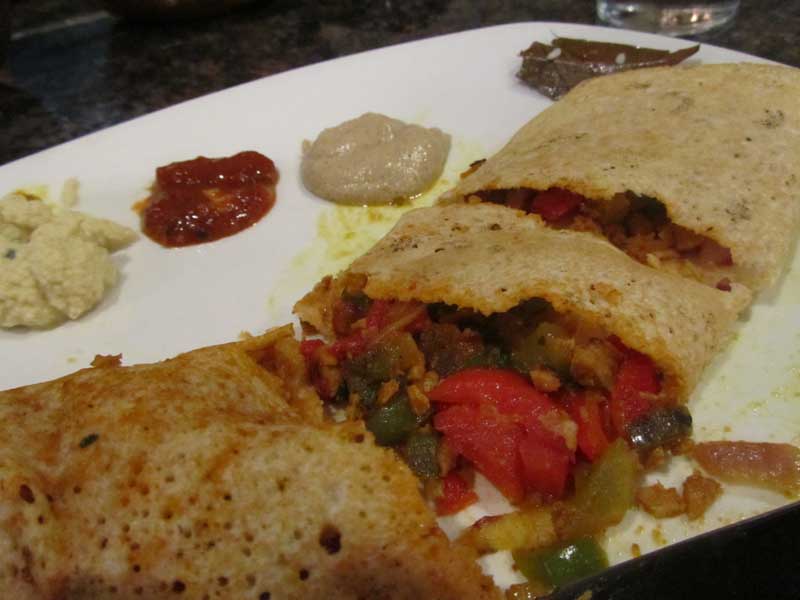
Where is `glass`? This screenshot has width=800, height=600. glass is located at coordinates (684, 15).